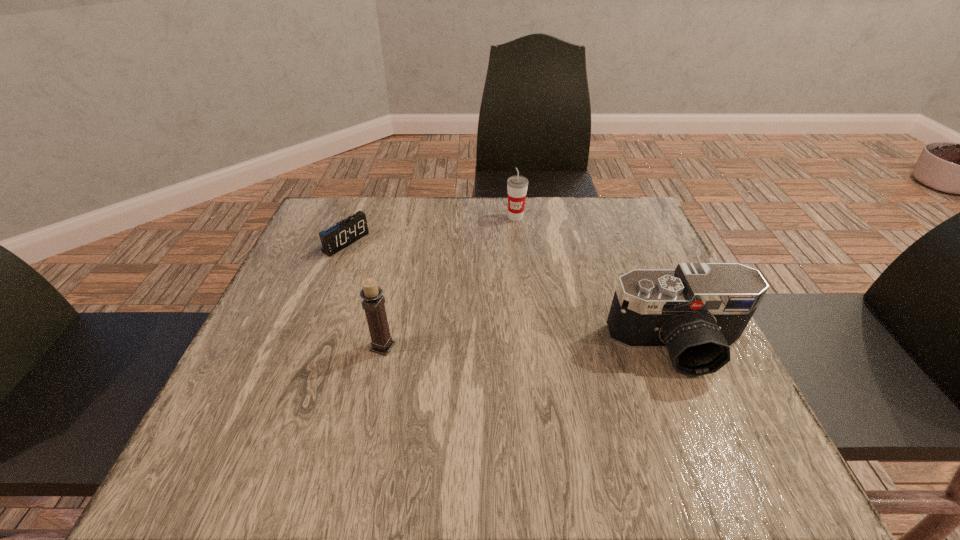
Locate an element on the screen. This screenshot has height=540, width=960. the third object from right to left is located at coordinates (374, 302).

Locate an element on the screen. the rightmost object is located at coordinates (698, 311).

This screenshot has width=960, height=540. Identify the location of the leftmost object. click(x=335, y=238).

Find the location of a particular element. This screenshot has width=960, height=540. the third nearest object is located at coordinates (335, 238).

Find the location of a particular element. This screenshot has width=960, height=540. the second object from right to left is located at coordinates [x=517, y=186].

This screenshot has width=960, height=540. Find the location of `cup`. cup is located at coordinates (517, 186).

At what (x,y) coordinates should I click in order to perform the action: click on vacant space situated on the right of the third object from right to left. Please return your answer as a coordinate pair (x, y). Looking at the image, I should click on (575, 347).

I want to click on free space located 0.060m on the front-facing side of the rightmost object, so [704, 410].

Identify the location of vacant region located on the front-facing side of the leftmost object. The height and width of the screenshot is (540, 960). (396, 273).

This screenshot has width=960, height=540. What are the coordinates of `vacant space located 0.170m on the front-facing side of the leftmost object` in the screenshot? It's located at (408, 280).